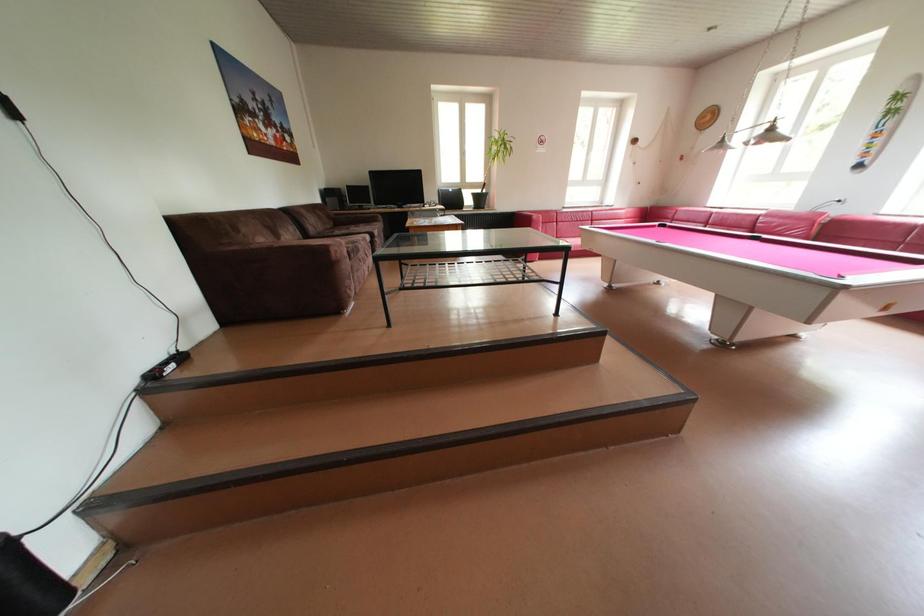
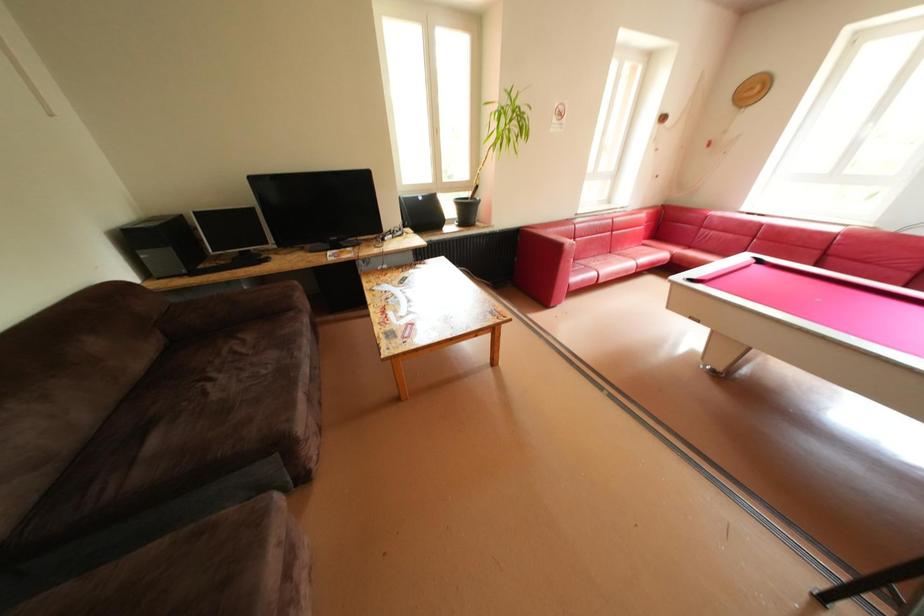
Question: Which direction would the cameraman need to move to produce the second image? Reply with the corresponding letter.

Choices:
 (A) Left
 (B) Right
 (C) Forward
 (D) Backward

Answer: (C)